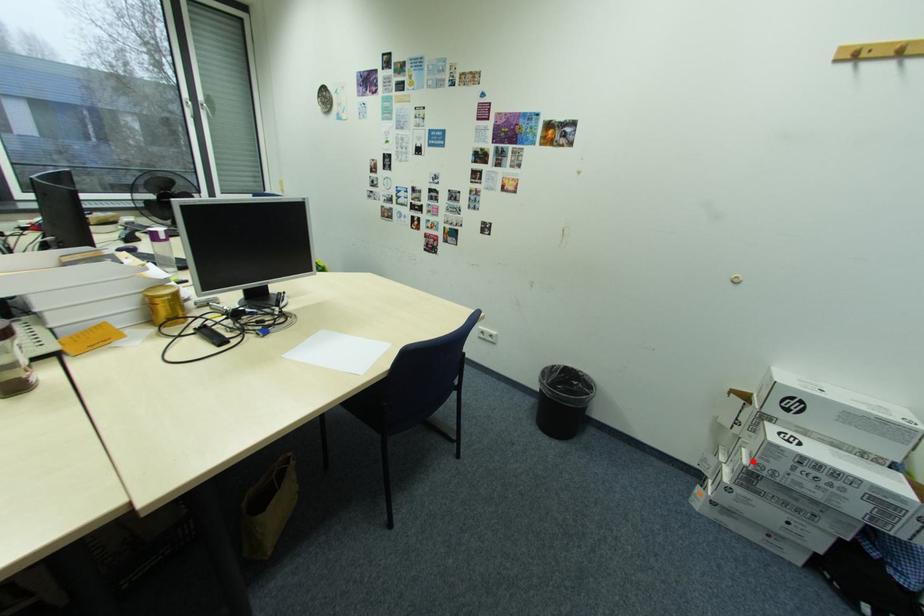
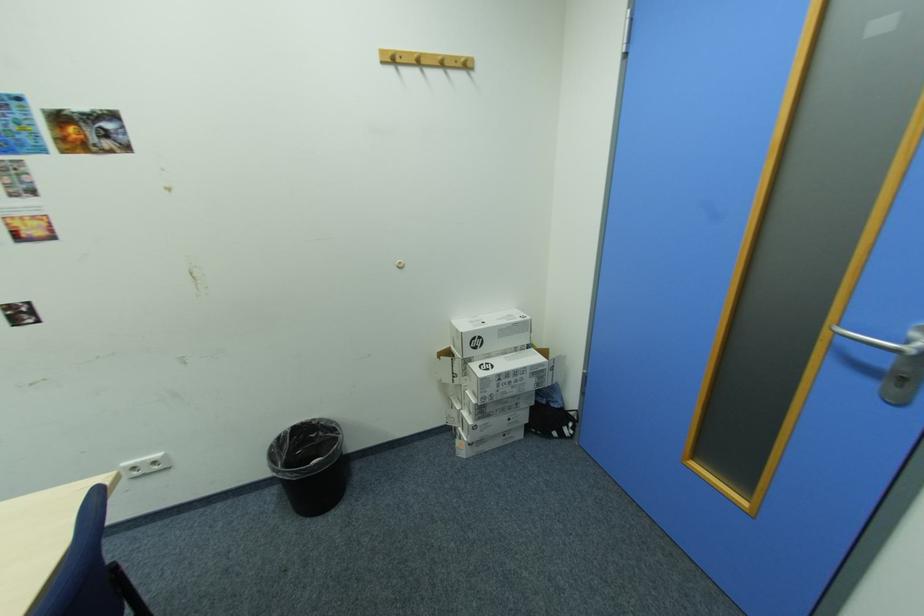
Where in the second image is the point corresponding to the highlighted location from the first image?

(481, 400)